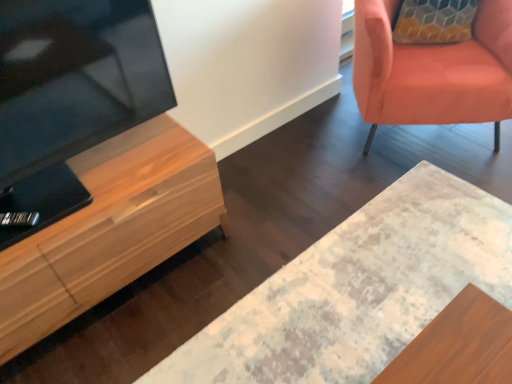
Find the location of a particular element. Image resolution: width=512 pixels, height=384 pixels. vacant region to the right of light wood cabinet at left is located at coordinates (248, 230).